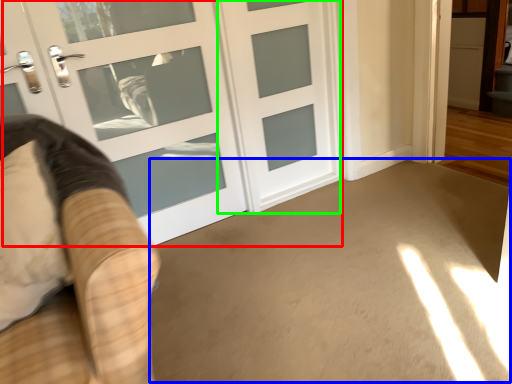
Question: Estimate the real-world distances between objects in this image. Which object is farther from door (highlighted by a red box), corridor (highlighted by a blue box) or door (highlighted by a green box)?

Choices:
 (A) corridor
 (B) door

Answer: (A)